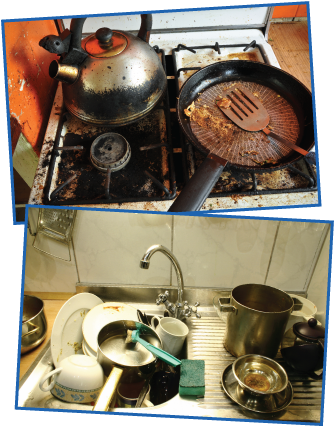
The width and height of the screenshot is (335, 427). I want to click on tile wall above sink, so click(206, 348), click(114, 243).